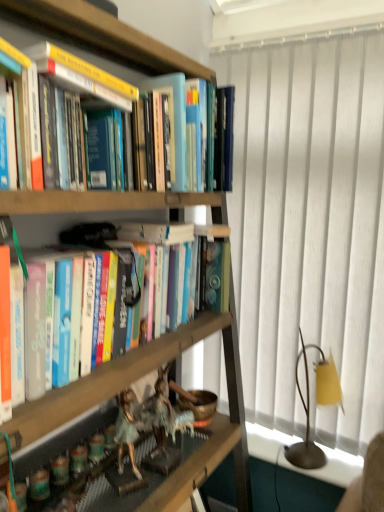
Question: From a real-world perspective, is white textured curtain at right positioned under yellow fabric lampshade at right based on gravity?

Choices:
 (A) no
 (B) yes

Answer: (A)

Question: Does white textured curtain at right have a greater width compared to yellow fabric lampshade at right?

Choices:
 (A) no
 (B) yes

Answer: (A)

Question: Does white textured curtain at right lie in front of yellow fabric lampshade at right?

Choices:
 (A) yes
 (B) no

Answer: (A)

Question: From the image's perspective, is white textured curtain at right beneath yellow fabric lampshade at right?

Choices:
 (A) yes
 (B) no

Answer: (B)

Question: From the image's perspective, is white textured curtain at right above yellow fabric lampshade at right?

Choices:
 (A) no
 (B) yes

Answer: (B)

Question: Visually, is yellow fabric lampshade at right positioned to the left or to the right of metallic figurines at lower left?

Choices:
 (A) right
 (B) left

Answer: (A)

Question: In the image, is yellow fabric lampshade at right positioned in front of or behind metallic figurines at lower left?

Choices:
 (A) front
 (B) behind

Answer: (B)

Question: Considering the positions of yellow fabric lampshade at right and metallic figurines at lower left in the image, is yellow fabric lampshade at right taller or shorter than metallic figurines at lower left?

Choices:
 (A) short
 (B) tall

Answer: (B)

Question: Looking at their shapes, would you say yellow fabric lampshade at right is wider or thinner than metallic figurines at lower left?

Choices:
 (A) thin
 (B) wide

Answer: (B)

Question: Considering their positions, is wooden bookcase at left located in front of or behind metallic figurines at lower left?

Choices:
 (A) front
 (B) behind

Answer: (A)

Question: From the image's perspective, is wooden bookcase at left located above or below metallic figurines at lower left?

Choices:
 (A) above
 (B) below

Answer: (A)

Question: Looking at their shapes, would you say wooden bookcase at left is wider or thinner than metallic figurines at lower left?

Choices:
 (A) thin
 (B) wide

Answer: (B)

Question: Is wooden bookcase at left inside or outside of metallic figurines at lower left?

Choices:
 (A) inside
 (B) outside

Answer: (B)

Question: From their relative heights in the image, would you say hardcover books at center is taller or shorter than wooden bookcase at left?

Choices:
 (A) short
 (B) tall

Answer: (A)

Question: In the image, is hardcover books at center positioned in front of or behind wooden bookcase at left?

Choices:
 (A) behind
 (B) front

Answer: (A)